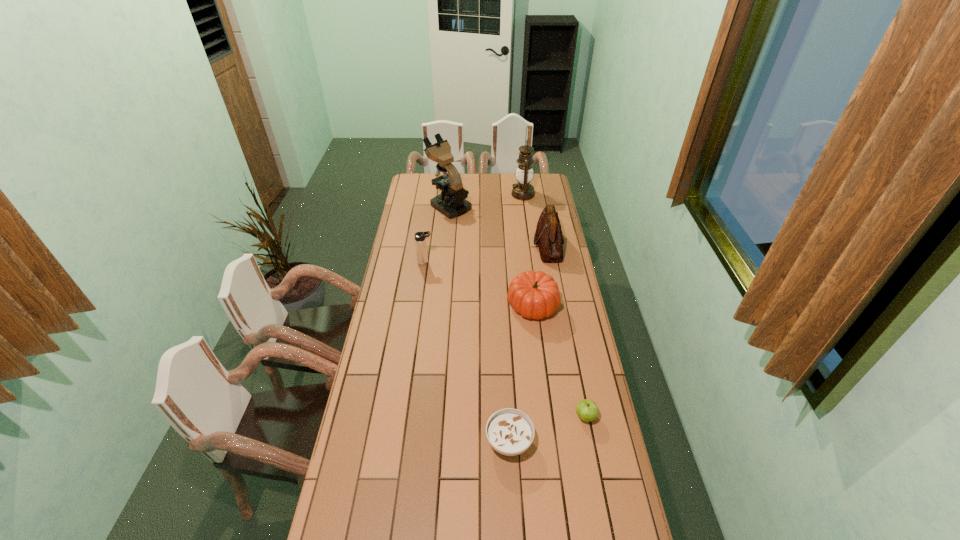
Locate an element on the screen. vacant space that satisfies the following two spatial constraints: 1. on the front side of the fifth shortest object; 2. on the handle side of the thermos bottle is located at coordinates (551, 262).

This screenshot has height=540, width=960. I want to click on blank space that satisfies the following two spatial constraints: 1. on the back side of the oil lamp; 2. on the right side of the soup bowl, so click(x=496, y=194).

What are the coordinates of `vacant space that satisfies the following two spatial constraints: 1. on the front side of the oil lamp; 2. on the handle side of the thermos bottle` in the screenshot? It's located at (532, 262).